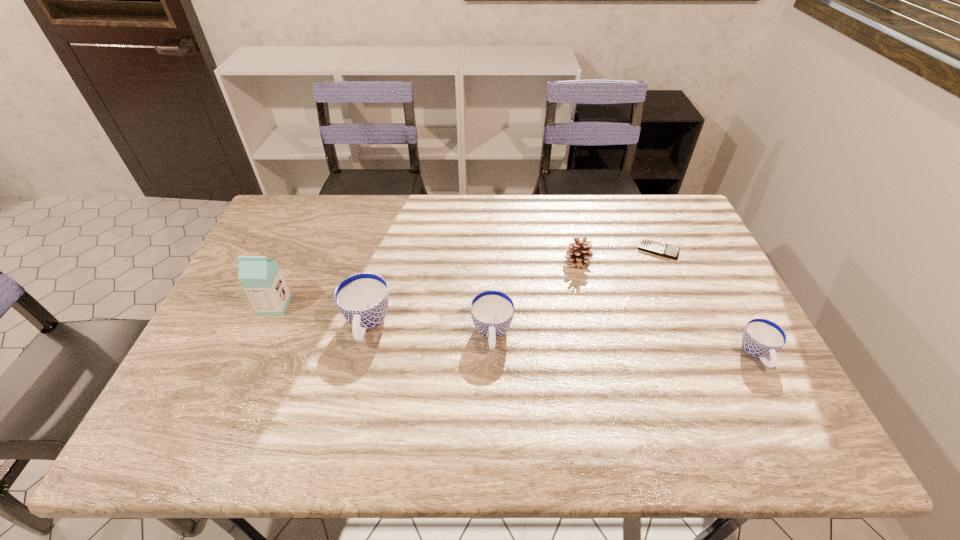
The image size is (960, 540). Find the location of `the tallest cup`. the tallest cup is located at coordinates (363, 298).

The height and width of the screenshot is (540, 960). I want to click on the leftmost cup, so click(x=363, y=298).

At what (x,y) coordinates should I click in order to perform the action: click on the second cup from right to left. Please return your answer as a coordinate pair (x, y). Looking at the image, I should click on (492, 311).

The image size is (960, 540). I want to click on the third object from left to right, so click(492, 311).

The width and height of the screenshot is (960, 540). What are the coordinates of `the fifth tallest object` in the screenshot? It's located at (762, 338).

Where is `the shortest cup`? The width and height of the screenshot is (960, 540). the shortest cup is located at coordinates (762, 338).

Find the location of `calculator`. calculator is located at coordinates (647, 245).

In order to click on the shortest object in this screenshot , I will do `click(647, 245)`.

The height and width of the screenshot is (540, 960). In order to click on the tallest object in this screenshot , I will do `click(261, 278)`.

What are the coordinates of `milk carton` in the screenshot? It's located at (261, 278).